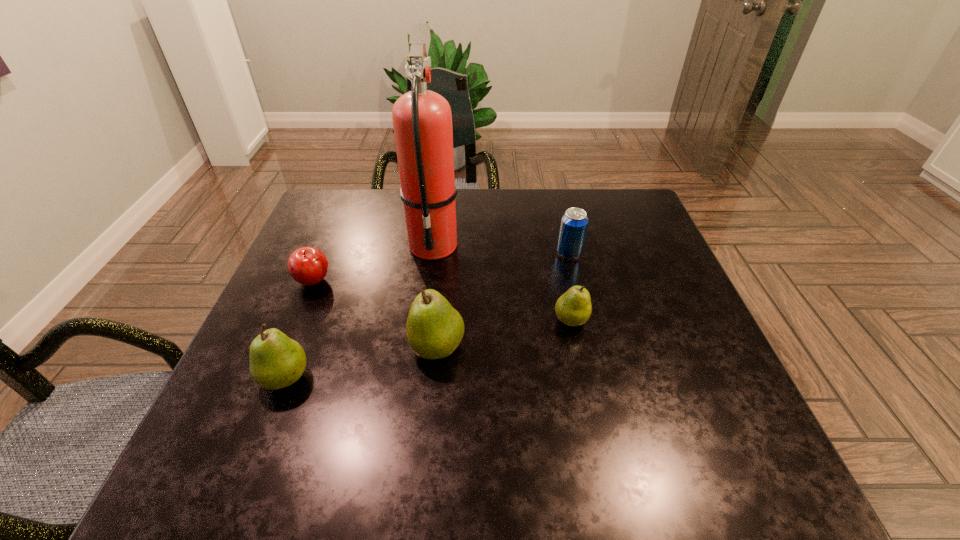
Find the location of `vacant area at the left edge`. vacant area at the left edge is located at coordinates (280, 329).

Find the location of `vacant region at the right edge`. vacant region at the right edge is located at coordinates (636, 268).

You are a GUI agent. You are given a task and a screenshot of the screen. Output one action in this format:
    pyautogui.click(x=<x>, y=<y>)
    Task: Click on the vacant region at the near left corner of the desktop
    This screenshot has width=960, height=540.
    Given the screenshot: What is the action you would take?
    pyautogui.click(x=301, y=396)

Find the location of `vacant space at the far right corner of the desktop`. vacant space at the far right corner of the desktop is located at coordinates (610, 220).

Where is `free region at the near right corner of the desktop`? free region at the near right corner of the desktop is located at coordinates (665, 420).

The width and height of the screenshot is (960, 540). I want to click on vacant area between the second pear from left to right and the cherry, so click(375, 314).

Locate an element on the screen. free point between the cherry and the beer can is located at coordinates (442, 267).

Identify the location of unoccupied area between the cherry and the beer can. The width and height of the screenshot is (960, 540). (442, 267).

You are a GUI agent. You are given a task and a screenshot of the screen. Output one action in this format:
    pyautogui.click(x=<x>, y=<y>)
    Task: Click on the free space between the cherry and the beer can
    The height and width of the screenshot is (540, 960).
    Given the screenshot: What is the action you would take?
    pyautogui.click(x=442, y=267)

Where is `vacant area that lies between the beer can and the cherry`? The height and width of the screenshot is (540, 960). vacant area that lies between the beer can and the cherry is located at coordinates (442, 267).